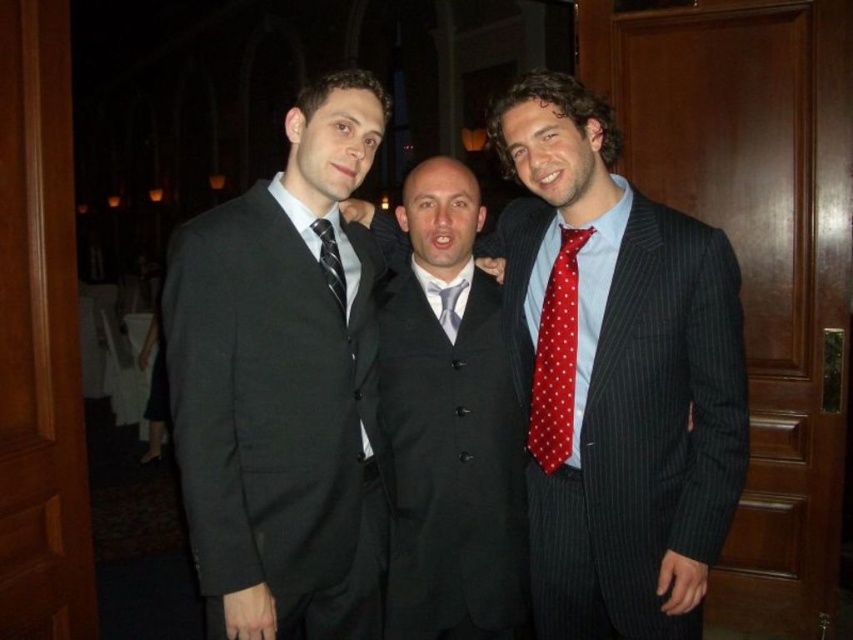
Which is more to the left, pinstriped suit at center or black silk tie at center?

black silk tie at center

Can you confirm if pinstriped suit at center is taller than black silk tie at center?

Correct, pinstriped suit at center is much taller as black silk tie at center.

Measure the distance between point (595,307) and camera.

They are 5.85 feet apart.

Locate an element on the screen. This screenshot has height=640, width=853. pinstriped suit at center is located at coordinates (614, 372).

Is black wool suit at center thinner than black silk tie at center?

→ In fact, black wool suit at center might be wider than black silk tie at center.

Between point (498, 532) and point (318, 230), which one is positioned in front?

Positioned in front is point (318, 230).

Which is in front, point (428, 582) or point (334, 257)?

Point (334, 257) is in front.

Find the location of a particular element. The height and width of the screenshot is (640, 853). black wool suit at center is located at coordinates (448, 422).

Is black wool suit at left closer to camera compared to black wool suit at center?

Yes, it is.

Which is above, black wool suit at left or black wool suit at center?

black wool suit at center

Between point (287, 568) and point (421, 163), which one is positioned in front?

Point (287, 568)

Identify the location of black wool suit at left. The image size is (853, 640). (276, 413).